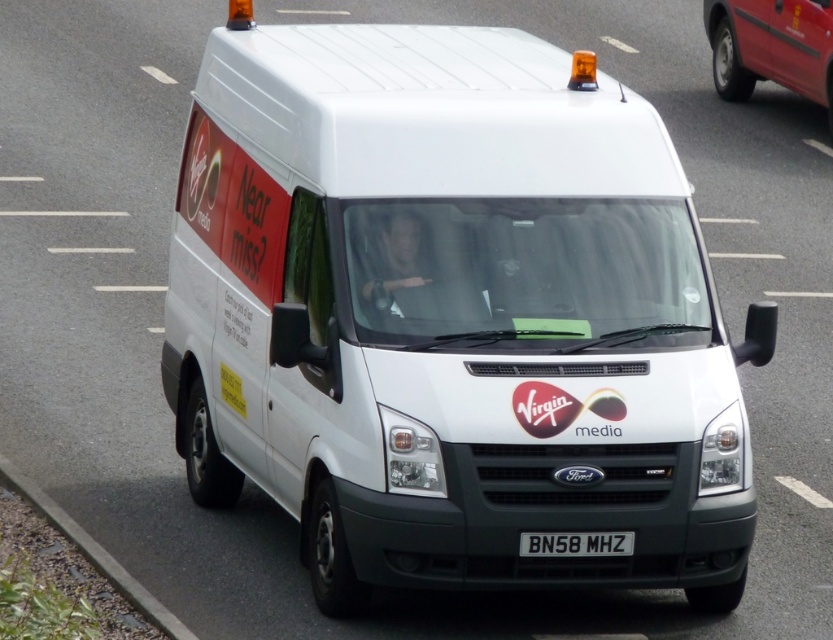
Is white matte van at center below metallic red van at upper right?

Correct, white matte van at center is located below metallic red van at upper right.

Between white matte van at center and metallic red van at upper right, which one has more height?

Standing taller between the two is white matte van at center.

Find the location of a particular element. The image size is (833, 640). white matte van at center is located at coordinates (451, 314).

Can you confirm if metallic red van at upper right is positioned to the right of black plastic license plate at center?

Yes, metallic red van at upper right is to the right of black plastic license plate at center.

Does point (771, 60) lie in front of point (547, 554)?

No, it is not.

The image size is (833, 640). Describe the element at coordinates (771, 45) in the screenshot. I see `metallic red van at upper right` at that location.

I want to click on metallic red van at upper right, so click(x=771, y=45).

Who is higher up, white matte van at center or black plastic license plate at center?

white matte van at center is above.

What are the coordinates of `white matte van at center` in the screenshot? It's located at (451, 314).